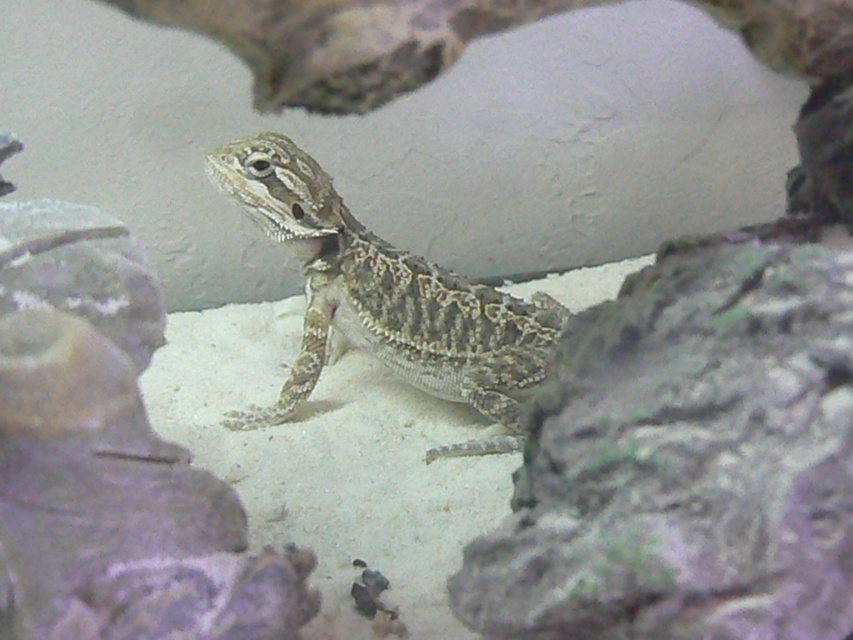
Question: Which of the following is the closest to the observer?

Choices:
 (A) tap(612, 307)
 (B) tap(399, 323)

Answer: (A)

Question: Is gray rough rock at lower right above camouflage-patterned lizard at center?

Choices:
 (A) yes
 (B) no

Answer: (B)

Question: Is gray rough rock at lower right to the left of camouflage-patterned lizard at center from the viewer's perspective?

Choices:
 (A) no
 (B) yes

Answer: (A)

Question: Which point is farther to the camera?

Choices:
 (A) (323, 237)
 (B) (666, 620)

Answer: (A)

Question: Does gray rough rock at lower right appear over camouflage-patterned lizard at center?

Choices:
 (A) no
 (B) yes

Answer: (A)